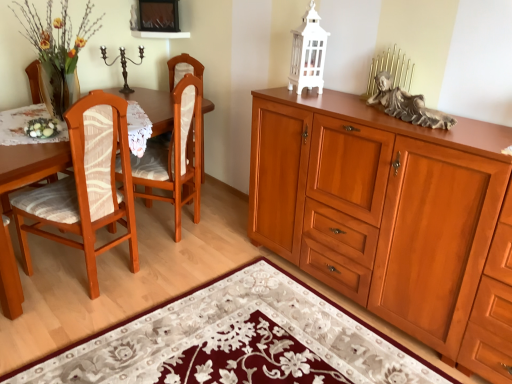
The width and height of the screenshot is (512, 384). In order to click on free space in front of wooden chair at left, placed as the first chair when sorted from front to back in this screenshot , I will do `click(62, 321)`.